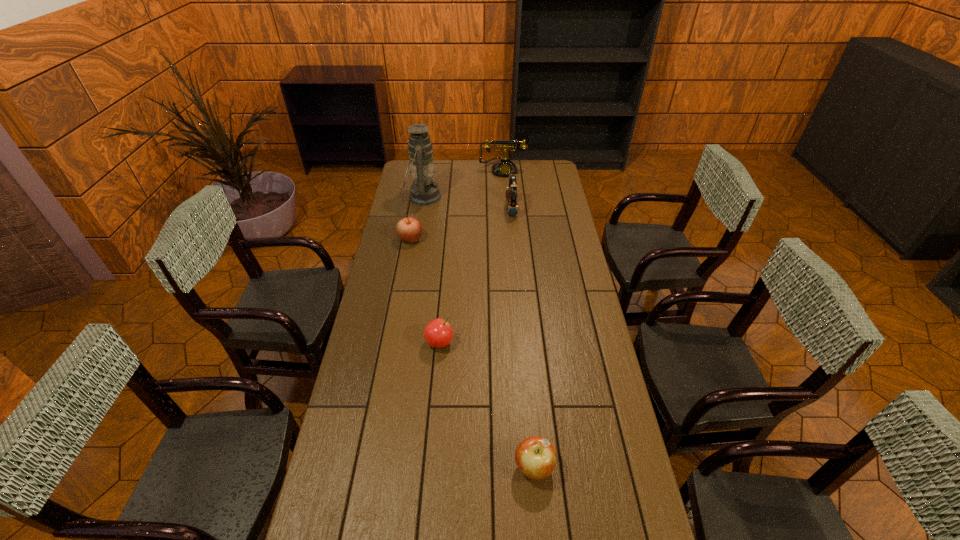
At what (x,y) coordinates should I click in order to perform the action: click on free space located 0.100m on the dial of the telephone. Please return your answer as a coordinate pair (x, y). Looking at the image, I should click on (504, 188).

Locate an element on the screen. This screenshot has height=540, width=960. vacant area situated 0.180m on the ear cup of the headset is located at coordinates (468, 209).

Find the location of a particular element. free space located on the ear cup of the headset is located at coordinates (467, 209).

At what (x,y) coordinates should I click in order to perform the action: click on vacant space located 0.190m on the ear cup of the headset. Please return your answer as a coordinate pair (x, y). Image resolution: width=960 pixels, height=540 pixels. Looking at the image, I should click on (467, 209).

Locate an element on the screen. This screenshot has width=960, height=540. free spot located 0.340m on the right of the farthest apple is located at coordinates (499, 239).

At what (x,y) coordinates should I click in order to perform the action: click on vacant space located on the left of the nearest object. Please return your answer as a coordinate pair (x, y). The image size is (960, 540). Looking at the image, I should click on (401, 467).

At what (x,y) coordinates should I click in order to perform the action: click on vacant space located 0.120m on the right of the second apple from right to left. Please return your answer as a coordinate pair (x, y). Looking at the image, I should click on (489, 342).

This screenshot has height=540, width=960. Find the location of `object that is at the far edge`. object that is at the far edge is located at coordinates (504, 167).

In order to click on oil lamp that is at the left edge in this screenshot , I will do `click(424, 191)`.

The image size is (960, 540). In order to click on apple at the left edge in this screenshot , I will do `click(409, 229)`.